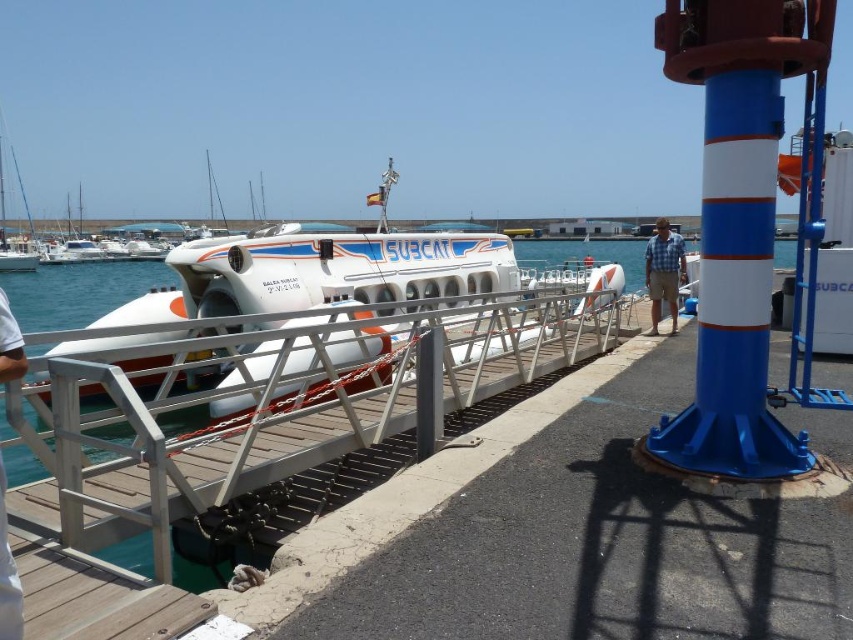
From the picture: Is white glossy submarine at center positioned at the back of skinny jeans at lower left?

Yes.

Who is lower down, white glossy submarine at center or skinny jeans at lower left?

skinny jeans at lower left is below.

Measure the distance between point (234, 312) and camera.

Point (234, 312) is 10.65 meters from camera.

Image resolution: width=853 pixels, height=640 pixels. Identify the location of white glossy submarine at center. (320, 272).

Can you confirm if blue checkered shirt at center is wider than skinny jeans at lower left?

Correct, the width of blue checkered shirt at center exceeds that of skinny jeans at lower left.

Is blue checkered shirt at center below skinny jeans at lower left?

No, blue checkered shirt at center is not below skinny jeans at lower left.

Who is more distant from viewer, [659,282] or [10,333]?

Point [659,282]

Identify the location of blue checkered shirt at center. tap(663, 273).

Looking at this image, is silver metallic rail at center further to the viewer compared to blue checkered shirt at center?

No, silver metallic rail at center is in front of blue checkered shirt at center.

Can you confirm if silver metallic rail at center is taller than blue checkered shirt at center?

Incorrect, silver metallic rail at center's height is not larger of blue checkered shirt at center's.

The width and height of the screenshot is (853, 640). In order to click on silver metallic rail at center in this screenshot , I will do `click(196, 454)`.

Where is `silver metallic rail at center`? silver metallic rail at center is located at coordinates (196, 454).